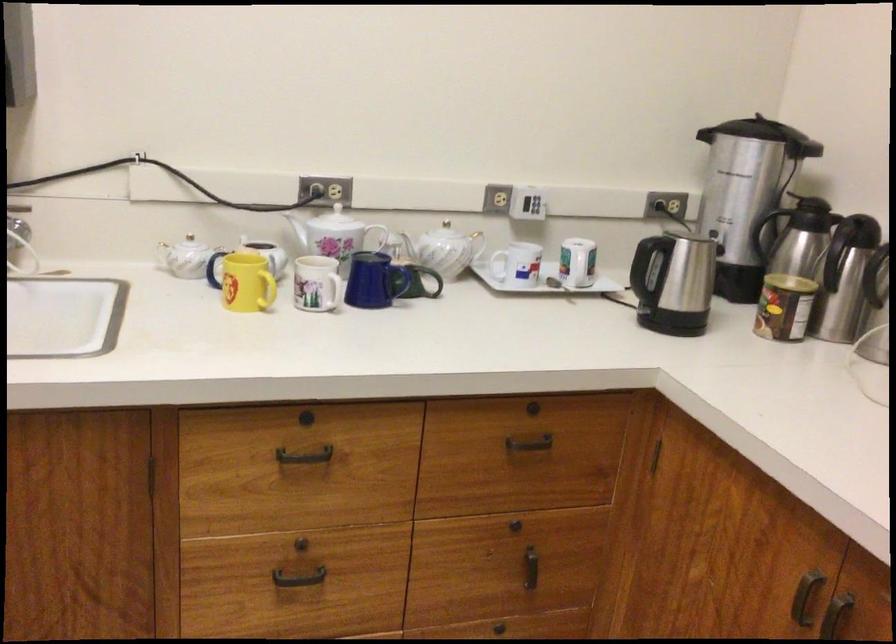
Locate an element on the screen. blue mug handle is located at coordinates (375, 281).